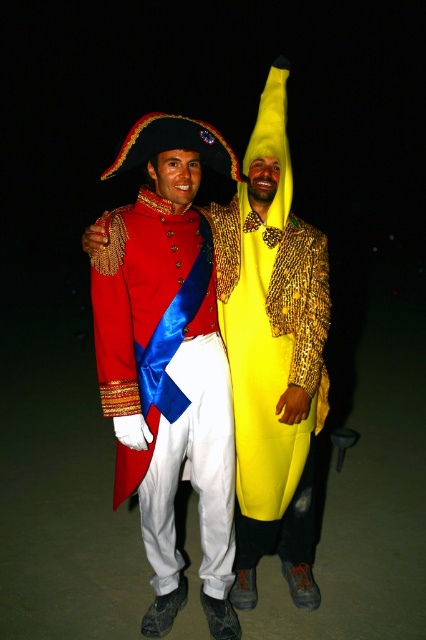
Question: Which object is farther from the camera taking this photo?

Choices:
 (A) yellow matte banana at center
 (B) shiny red coat at center

Answer: (A)

Question: Is shiny red coat at center to the left of yellow matte banana at center from the viewer's perspective?

Choices:
 (A) no
 (B) yes

Answer: (B)

Question: Does shiny red coat at center have a larger size compared to yellow matte banana at center?

Choices:
 (A) no
 (B) yes

Answer: (B)

Question: Can you confirm if shiny red coat at center is smaller than yellow matte banana at center?

Choices:
 (A) yes
 (B) no

Answer: (B)